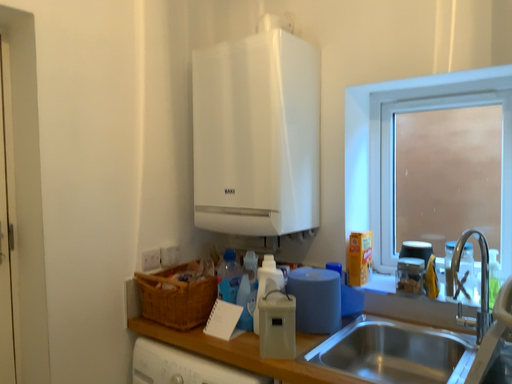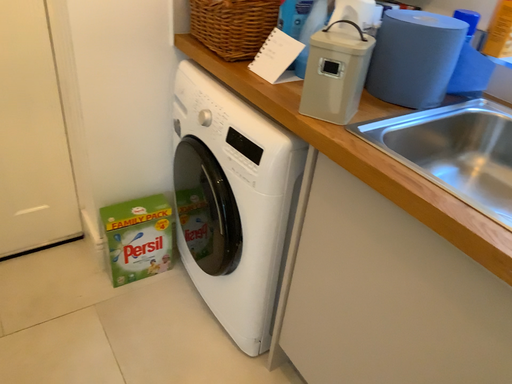
Question: How did the camera likely rotate when shooting the video?

Choices:
 (A) rotated downward
 (B) rotated upward

Answer: (A)